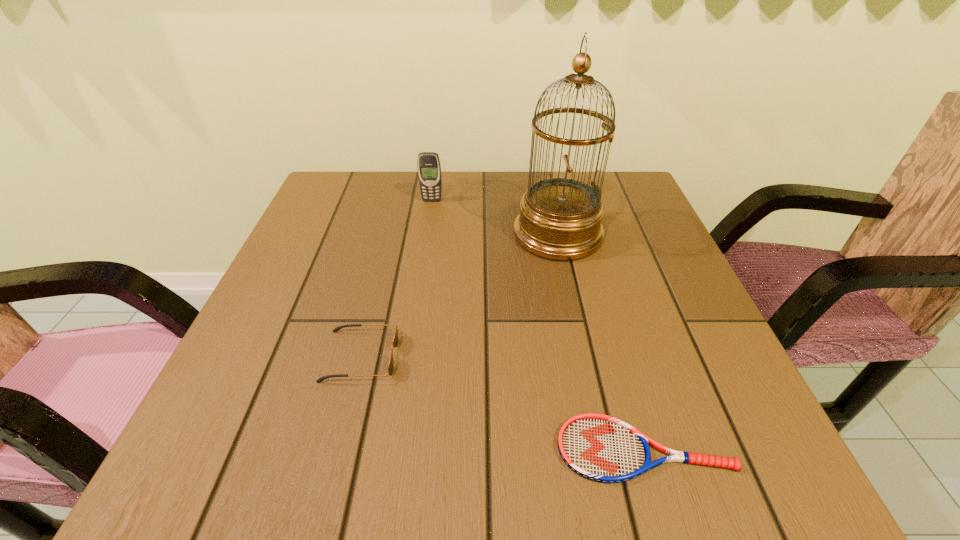
Locate an element on the screen. The image size is (960, 540). birdcage is located at coordinates (560, 218).

Locate an element on the screen. the third nearest object is located at coordinates (560, 218).

At what (x,y) coordinates should I click in order to perform the action: click on the second tallest object. Please return your answer as a coordinate pair (x, y). The height and width of the screenshot is (540, 960). Looking at the image, I should click on (429, 168).

Image resolution: width=960 pixels, height=540 pixels. What are the coordinates of `the farthest object` in the screenshot? It's located at (429, 168).

The image size is (960, 540). I want to click on the third tallest object, so click(395, 342).

Locate an element on the screen. Image resolution: width=960 pixels, height=540 pixels. the second nearest object is located at coordinates (395, 342).

Find the location of a particular element. The width and height of the screenshot is (960, 540). tennis racket is located at coordinates (598, 447).

The image size is (960, 540). I want to click on the nearest object, so click(598, 447).

Locate an element on the screen. This screenshot has width=960, height=540. blank space located 0.230m with an open door on the birdcage is located at coordinates (415, 234).

Find the location of `vacant region located 0.070m with an open door on the birdcage`. vacant region located 0.070m with an open door on the birdcage is located at coordinates (483, 234).